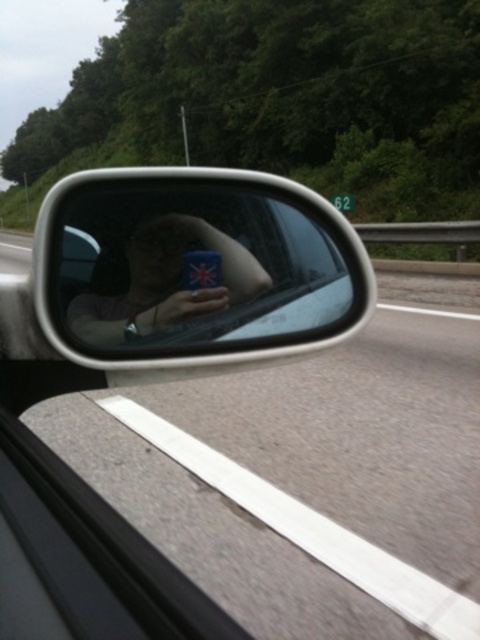
Based on the photo, between metallic blue phone at center and asphalt road at lower left, which one has more height?

With more height is asphalt road at lower left.

The height and width of the screenshot is (640, 480). What do you see at coordinates (167, 282) in the screenshot?
I see `metallic blue phone at center` at bounding box center [167, 282].

What do you see at coordinates (167, 282) in the screenshot? The width and height of the screenshot is (480, 640). I see `metallic blue phone at center` at bounding box center [167, 282].

This screenshot has height=640, width=480. I want to click on metallic blue phone at center, so click(x=167, y=282).

Is silver metallic mirror at center below asphalt road at lower left?

Yes.

What do you see at coordinates (186, 266) in the screenshot?
I see `silver metallic mirror at center` at bounding box center [186, 266].

Find the location of a particular element. This screenshot has height=640, width=480. silver metallic mirror at center is located at coordinates (186, 266).

Consider the image. Who is lower down, silver metallic mirror at center or metallic blue phone at center?

metallic blue phone at center is below.

Does silver metallic mirror at center come in front of metallic blue phone at center?

Yes, it is.

You are a GUI agent. You are given a task and a screenshot of the screen. Output one action in this format:
    pyautogui.click(x=<x>, y=<y>)
    Task: Click on the silver metallic mirror at center
    
    Given the screenshot: What is the action you would take?
    pyautogui.click(x=186, y=266)